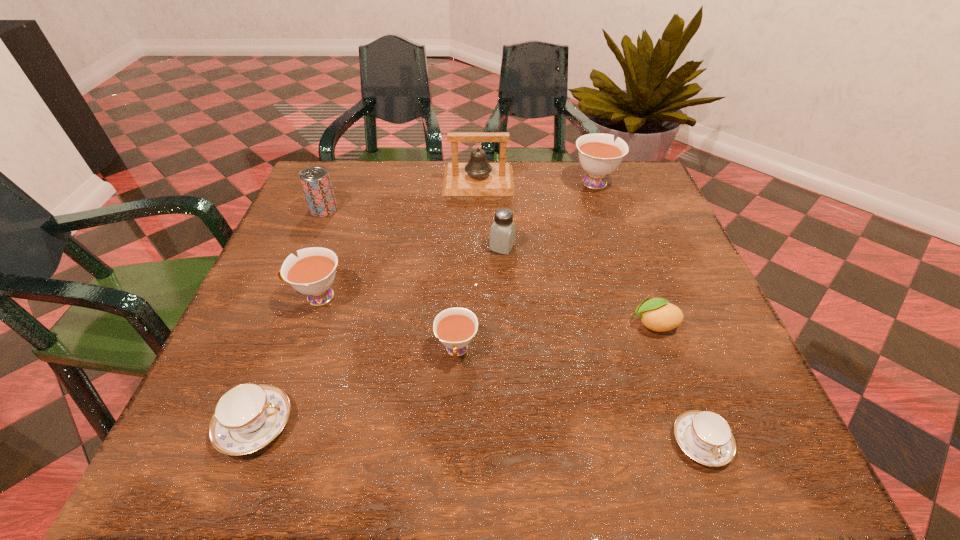
Select which white teacup is the closest to the shortest teacup. Please provide its 2D coordinates. Your answer should be formatted as a tuple, i.e. [(x, y)], where the tuple contains the x and y coordinates of a point satisfying the conditions above.

[(455, 327)]

The height and width of the screenshot is (540, 960). What are the coordinates of `vacant space that satisfies the following two spatial constraints: 1. on the front side of the bell; 2. on the side with the handle of the bigger blue teacup` in the screenshot? It's located at (477, 424).

At what (x,y) coordinates should I click in order to perform the action: click on free space that satisfies the following two spatial constraints: 1. with leaves positioned above the yellow lemon; 2. on the side of the smallest white teacup with the handle. Please return your answer as a coordinate pair (x, y). Looking at the image, I should click on (663, 350).

The image size is (960, 540). Identify the location of vacant region that satisfies the following two spatial constraints: 1. with leaves positioned above the lemon; 2. on the side of the third nearest teacup with the handle. (663, 350).

The height and width of the screenshot is (540, 960). In order to click on vacant area that satisfies the following two spatial constraints: 1. on the side of the third farthest teacup with the handle; 2. on the side with the handle of the left blue teacup in this screenshot , I will do [453, 424].